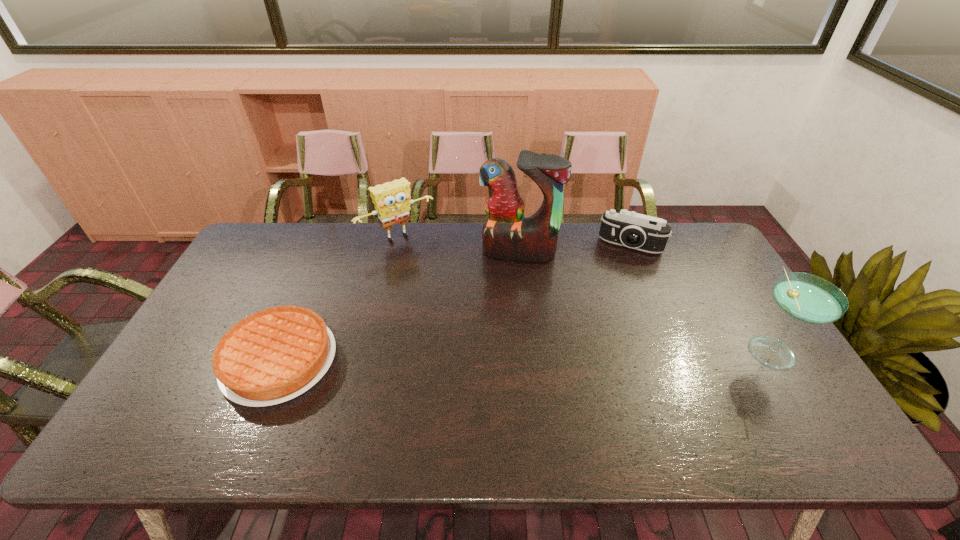
Choose which object is the third nearest neighbor to the sponge. Please provide its 2D coordinates. Your answer should be formatted as a tuple, i.e. [(x, y)], where the tuple contains the x and y coordinates of a point satisfying the conditions above.

[(629, 229)]

Where is `vacant region that satisfies the following two spatial constraints: 1. on the back side of the pie; 2. on the left side of the martini`? vacant region that satisfies the following two spatial constraints: 1. on the back side of the pie; 2. on the left side of the martini is located at coordinates (284, 349).

Locate an element on the screen. The image size is (960, 540). free space in the image that satisfies the following two spatial constraints: 1. on the front side of the third object from right to left; 2. on the left side of the sponge is located at coordinates (395, 252).

Find the location of a particular element. vacant area that satisfies the following two spatial constraints: 1. on the back side of the pie; 2. on the left side of the parrot is located at coordinates (324, 252).